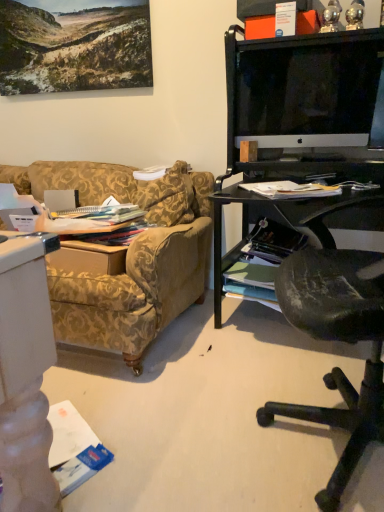
Question: Is white paper magazine at right, marked as the first magazine in a top-to-bottom arrangement, wider than shiny metallic magazine at lower right, arranged as the first magazine when ordered from the bottom?

Choices:
 (A) yes
 (B) no

Answer: (B)

Question: From a real-world perspective, is white paper magazine at right, placed as the second magazine when sorted from back to front, positioned under shiny metallic magazine at lower right, arranged as the 2th magazine when viewed from the front, based on gravity?

Choices:
 (A) yes
 (B) no

Answer: (B)

Question: Is white paper magazine at right, placed as the second magazine when sorted from back to front, oriented towards shiny metallic magazine at lower right, arranged as the first magazine when ordered from the bottom?

Choices:
 (A) no
 (B) yes

Answer: (A)

Question: Is white paper magazine at right, marked as the first magazine in a top-to-bottom arrangement, completely or partially outside of shiny metallic magazine at lower right, which is counted as the 1th magazine, starting from the back?

Choices:
 (A) no
 (B) yes

Answer: (B)

Question: Would you consider white paper magazine at right, the first magazine when ordered from front to back, to be distant from shiny metallic magazine at lower right, which is the second magazine from top to bottom?

Choices:
 (A) yes
 (B) no

Answer: (B)

Question: Choose the correct answer: Is white glossy monitor at upper right inside shiny metallic magazine at lower right, arranged as the first magazine when ordered from the bottom, or outside it?

Choices:
 (A) outside
 (B) inside

Answer: (A)

Question: Looking at the image, does white glossy monitor at upper right seem bigger or smaller compared to shiny metallic magazine at lower right, which is counted as the 1th magazine, starting from the back?

Choices:
 (A) small
 (B) big

Answer: (B)

Question: In terms of height, does white glossy monitor at upper right look taller or shorter compared to shiny metallic magazine at lower right, arranged as the 2th magazine when viewed from the front?

Choices:
 (A) tall
 (B) short

Answer: (A)

Question: From a real-world perspective, relative to shiny metallic magazine at lower right, arranged as the 2th magazine when viewed from the front, is white glossy monitor at upper right vertically above or below?

Choices:
 (A) above
 (B) below

Answer: (A)

Question: Is point (283, 248) closer or farther from the camera than point (261, 102)?

Choices:
 (A) closer
 (B) farther

Answer: (B)

Question: Is shiny metallic magazine at lower right, arranged as the 2th magazine when viewed from the front, spatially inside white glossy monitor at upper right, or outside of it?

Choices:
 (A) inside
 (B) outside

Answer: (B)

Question: From the image's perspective, is shiny metallic magazine at lower right, arranged as the 2th magazine when viewed from the front, positioned above or below white glossy monitor at upper right?

Choices:
 (A) below
 (B) above

Answer: (A)

Question: In terms of height, does shiny metallic magazine at lower right, which is counted as the 1th magazine, starting from the back, look taller or shorter compared to white glossy monitor at upper right?

Choices:
 (A) short
 (B) tall

Answer: (A)

Question: Considering the positions of white paper magazine at right, arranged as the 2th magazine when ordered from the bottom, and white glossy monitor at upper right in the image, is white paper magazine at right, arranged as the 2th magazine when ordered from the bottom, wider or thinner than white glossy monitor at upper right?

Choices:
 (A) thin
 (B) wide

Answer: (B)

Question: Do you think white paper magazine at right, arranged as the 2th magazine when ordered from the bottom, is within white glossy monitor at upper right, or outside of it?

Choices:
 (A) inside
 (B) outside

Answer: (B)